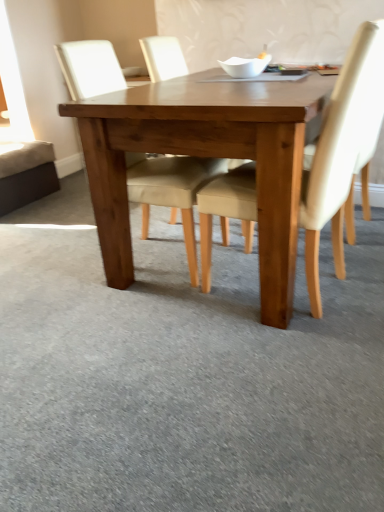
Describe the element at coordinates (342, 150) in the screenshot. I see `light beige fabric chair at center, the first chair when ordered from right to left` at that location.

In order to click on light brown wooden table at center in this screenshot , I will do `click(205, 155)`.

Which is more to the left, beige fabric chair at center, which is the first chair in left-to-right order, or light beige fabric chair at center, the first chair when ordered from right to left?

beige fabric chair at center, which is the first chair in left-to-right order, is more to the left.

Is beige fabric chair at center, the second chair positioned from the right, completely or partially outside of light beige fabric chair at center, positioned as the 2th chair in left-to-right order?

Yes.

Between point (154, 177) and point (373, 58), which one is positioned behind?

Point (154, 177)

From the image's perspective, is beige fabric chair at center, which is the first chair in left-to-right order, located beneath light beige fabric chair at center, positioned as the 2th chair in left-to-right order?

Actually, beige fabric chair at center, which is the first chair in left-to-right order, appears above light beige fabric chair at center, positioned as the 2th chair in left-to-right order, in the image.

You are a GUI agent. You are given a task and a screenshot of the screen. Output one action in this format:
    pyautogui.click(x=<x>, y=<y>)
    Task: Click on the kitchen & dining room table on the right of the beige fabric chair at center, which is the first chair in left-to-right order
    Image resolution: width=384 pixels, height=512 pixels.
    Given the screenshot: What is the action you would take?
    pyautogui.click(x=205, y=155)

Is beige fabric chair at center, the second chair positioned from the right, inside or outside of light brown wooden table at center?

beige fabric chair at center, the second chair positioned from the right, exists entirely within light brown wooden table at center.

Can you confirm if beige fabric chair at center, the second chair positioned from the right, is bigger than light brown wooden table at center?

No, beige fabric chair at center, the second chair positioned from the right, is not bigger than light brown wooden table at center.

Can you tell me how much beige fabric chair at center, the second chair positioned from the right, and light brown wooden table at center differ in facing direction?

There is a 93-degree angle between the facing directions of beige fabric chair at center, the second chair positioned from the right, and light brown wooden table at center.

From a real-world perspective, is light brown wooden table at center above or below light beige fabric chair at center, the first chair when ordered from right to left?

In terms of real-world spatial position, light brown wooden table at center is below light beige fabric chair at center, the first chair when ordered from right to left.

Does light brown wooden table at center appear on the right side of light beige fabric chair at center, positioned as the 2th chair in left-to-right order?

In fact, light brown wooden table at center is to the left of light beige fabric chair at center, positioned as the 2th chair in left-to-right order.

The width and height of the screenshot is (384, 512). Identify the location of kitchen & dining room table that appears below the light beige fabric chair at center, positioned as the 2th chair in left-to-right order (from a real-world perspective). (205, 155).

Relative to light beige fabric chair at center, positioned as the 2th chair in left-to-right order, is light brown wooden table at center in front or behind?

Clearly, light brown wooden table at center is behind light beige fabric chair at center, positioned as the 2th chair in left-to-right order.

Is light brown wooden table at center taller than beige fabric chair at center, the second chair positioned from the right?

No.

Locate an element on the screen. kitchen & dining room table below the beige fabric chair at center, which is the first chair in left-to-right order (from a real-world perspective) is located at coordinates (205, 155).

Would you say light brown wooden table at center is to the left or to the right of beige fabric chair at center, the second chair positioned from the right, in the picture?

light brown wooden table at center is to the right of beige fabric chair at center, the second chair positioned from the right.

Considering the points (334, 193) and (114, 287), which point is in front, point (334, 193) or point (114, 287)?

The point (334, 193) is closer.

From the image's perspective, relative to light brown wooden table at center, is light beige fabric chair at center, positioned as the 2th chair in left-to-right order, above or below?

light beige fabric chair at center, positioned as the 2th chair in left-to-right order, is below light brown wooden table at center.

Is light beige fabric chair at center, the first chair when ordered from right to left, located outside light brown wooden table at center?

That's incorrect, light beige fabric chair at center, the first chair when ordered from right to left, is not completely outside light brown wooden table at center.

In the scene shown: Who is bigger, light beige fabric chair at center, positioned as the 2th chair in left-to-right order, or light brown wooden table at center?

light brown wooden table at center is bigger.

Considering the relative sizes of light beige fabric chair at center, positioned as the 2th chair in left-to-right order, and beige fabric chair at center, the second chair positioned from the right, in the image provided, is light beige fabric chair at center, positioned as the 2th chair in left-to-right order, thinner than beige fabric chair at center, the second chair positioned from the right,?

Yes.

Is light beige fabric chair at center, the first chair when ordered from right to left, in front of or behind beige fabric chair at center, the second chair positioned from the right, in the image?

Visually, light beige fabric chair at center, the first chair when ordered from right to left, is located in front of beige fabric chair at center, the second chair positioned from the right.

Would you consider light beige fabric chair at center, positioned as the 2th chair in left-to-right order, to be distant from beige fabric chair at center, which is the first chair in left-to-right order?

Actually, light beige fabric chair at center, positioned as the 2th chair in left-to-right order, and beige fabric chair at center, which is the first chair in left-to-right order, are a little close together.

Image resolution: width=384 pixels, height=512 pixels. What are the coordinates of `chair that is on the right side of beige fabric chair at center, which is the first chair in left-to-right order` in the screenshot? It's located at (342, 150).

This screenshot has height=512, width=384. I want to click on chair that is the 1st object located below the light brown wooden table at center (from the image's perspective), so click(171, 190).

Based on their spatial positions, is light beige fabric chair at center, the first chair when ordered from right to left, or light brown wooden table at center further from beige fabric chair at center, the second chair positioned from the right?

The object further to beige fabric chair at center, the second chair positioned from the right, is light beige fabric chair at center, the first chair when ordered from right to left.

Considering their positions, is light brown wooden table at center positioned further to beige fabric chair at center, the second chair positioned from the right, than light beige fabric chair at center, the first chair when ordered from right to left?

light beige fabric chair at center, the first chair when ordered from right to left, is further to beige fabric chair at center, the second chair positioned from the right.

Which object lies further to the anchor point light beige fabric chair at center, the first chair when ordered from right to left, beige fabric chair at center, the second chair positioned from the right, or light brown wooden table at center?

The object further to light beige fabric chair at center, the first chair when ordered from right to left, is beige fabric chair at center, the second chair positioned from the right.

Estimate the real-world distances between objects in this image. Which object is closer to light brown wooden table at center, beige fabric chair at center, the second chair positioned from the right, or light beige fabric chair at center, positioned as the 2th chair in left-to-right order?

beige fabric chair at center, the second chair positioned from the right, is positioned closer to the anchor light brown wooden table at center.

Estimate the real-world distances between objects in this image. Which object is further from light brown wooden table at center, light beige fabric chair at center, positioned as the 2th chair in left-to-right order, or beige fabric chair at center, which is the first chair in left-to-right order?

light beige fabric chair at center, positioned as the 2th chair in left-to-right order.

Looking at the image, which one is located further to light beige fabric chair at center, positioned as the 2th chair in left-to-right order, light brown wooden table at center or beige fabric chair at center, which is the first chair in left-to-right order?

beige fabric chair at center, which is the first chair in left-to-right order, is further to light beige fabric chair at center, positioned as the 2th chair in left-to-right order.

The width and height of the screenshot is (384, 512). I want to click on kitchen & dining room table between beige fabric chair at center, which is the first chair in left-to-right order, and light beige fabric chair at center, the first chair when ordered from right to left, from left to right, so click(205, 155).